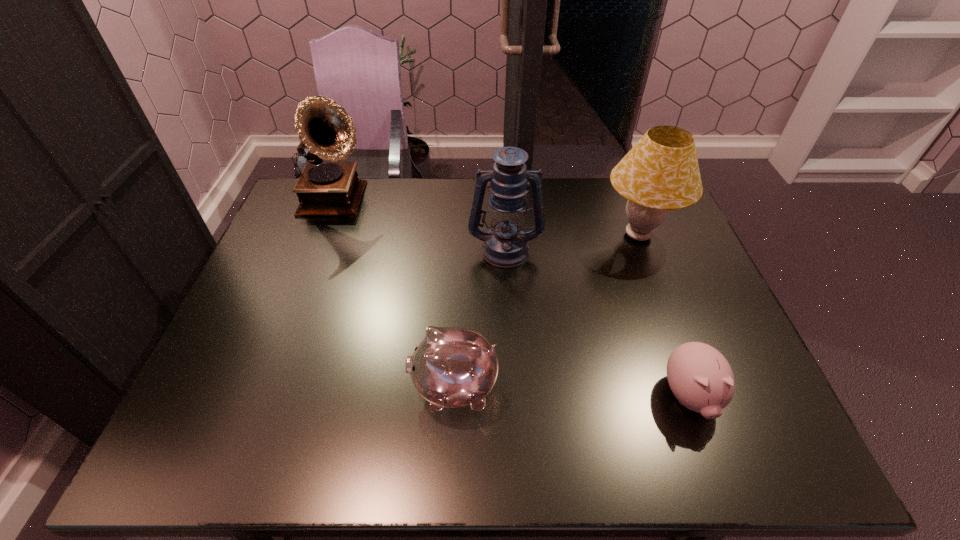
Image resolution: width=960 pixels, height=540 pixels. In order to click on free space between the lantern and the lampshade in this screenshot , I will do `click(571, 242)`.

Where is `empty space that is in between the lampshade and the record player`? empty space that is in between the lampshade and the record player is located at coordinates (488, 219).

This screenshot has width=960, height=540. Identify the location of vacant point located between the shortest object and the lampshade. (664, 316).

Identify the location of vacant space that's between the lampshade and the taller piggy bank. (546, 311).

You are a GUI agent. You are given a task and a screenshot of the screen. Output one action in this format:
    pyautogui.click(x=<x>, y=<y>)
    Task: Click on the free area in between the lampshade and the left piggy bank
    
    Given the screenshot: What is the action you would take?
    pyautogui.click(x=546, y=311)

I want to click on the third closest object to the leftmost object, so click(x=660, y=173).

Locate an element on the screen. This screenshot has width=960, height=540. the closest object to the shorter piggy bank is located at coordinates (660, 173).

This screenshot has width=960, height=540. What are the coordinates of `vacant space that satisfies the following two spatial constraints: 1. on the front-facing side of the lantern; 2. on the front facing side of the left piggy bank` in the screenshot? It's located at (514, 387).

The image size is (960, 540). Identify the location of vacant region that satisfies the following two spatial constraints: 1. on the horn of the lampshade; 2. on the left side of the record player. (324, 235).

Identify the location of free location that satisfies the following two spatial constraints: 1. on the front-facing side of the lantern; 2. on the front facing side of the taller piggy bank. (514, 387).